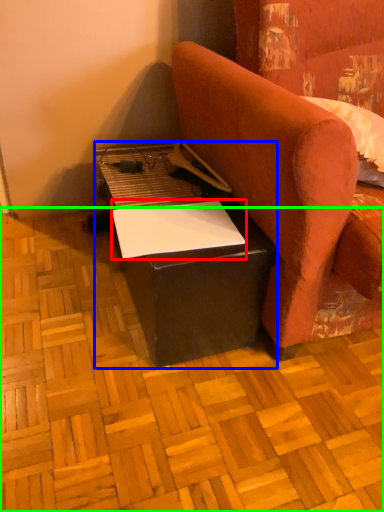
Question: Which object is the closest to the notepad (highlighted by a red box)? Choose among these: table (highlighted by a blue box) or plywood (highlighted by a green box).

Choices:
 (A) table
 (B) plywood

Answer: (A)